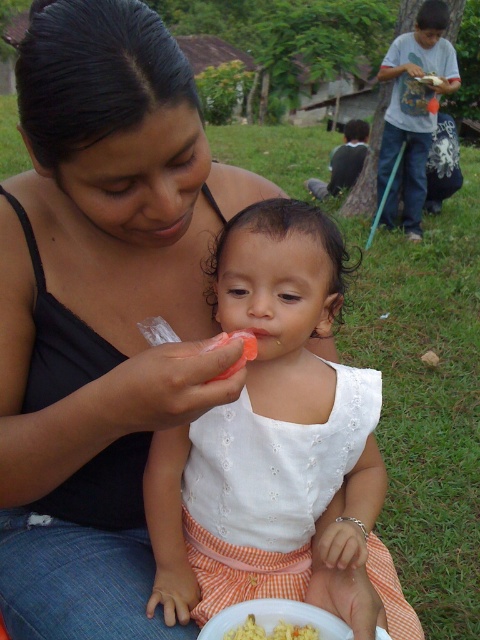
You are a photographer trying to capture the orange checkered skirt at center and the yellow matte scrambled eggs at lower center in a single frame. Which object should you focus on first to ensure both are in the frame without moving the camera?

The orange checkered skirt at center is bigger than the yellow matte scrambled eggs at lower center, so you should focus on the orange checkered skirt at center first to ensure both fit in the frame.

You are a photographer trying to capture the orange checkered skirt at center in your photo. What coordinates should you focus on to ensure it is centered in your shot?

You should focus on the coordinates point (344,161) to center the orange checkered skirt at center in your photo.

You are a photographer trying to capture a closeup of the yellow matte scrambled eggs at lower center without the orange checkered skirt at center blocking the view. Is this possible given their positions?

The orange checkered skirt at center is further to the viewer than yellow matte scrambled eggs at lower center, so the skirt is closer to the photographer. This means the skirt would block the view of the eggs, making it impossible to capture a clear closeup without moving either the camera or the subject.